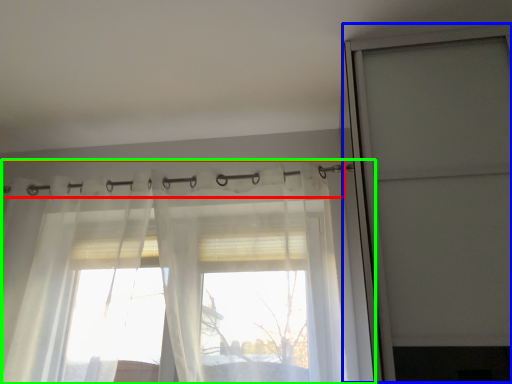
Question: Which is nearer to the clothesline (highlighted by a red box)? screen door (highlighted by a blue box) or curtain (highlighted by a green box).

Choices:
 (A) screen door
 (B) curtain

Answer: (A)